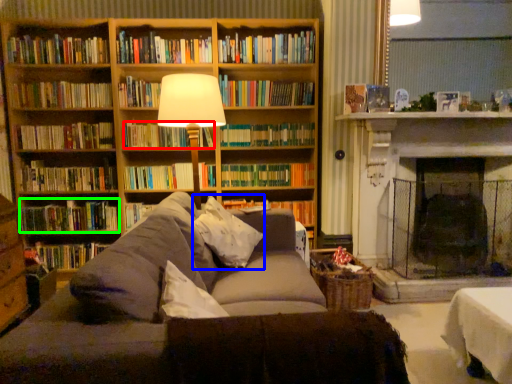
Question: Which is nearer to the book (highlighted by a red box)? pillow (highlighted by a blue box) or book (highlighted by a green box).

Choices:
 (A) pillow
 (B) book

Answer: (B)